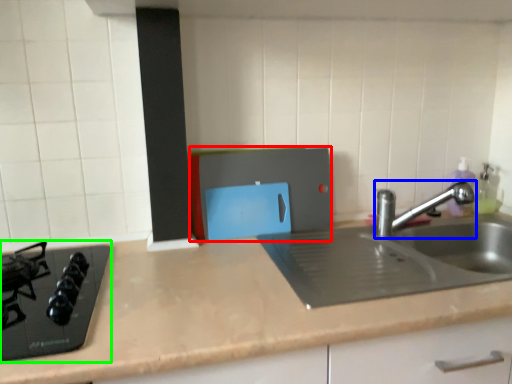
Question: Which object is the closest to the appliance (highlighted by a red box)? Choose among these: tap (highlighted by a blue box) or gas stove (highlighted by a green box).

Choices:
 (A) tap
 (B) gas stove

Answer: (A)